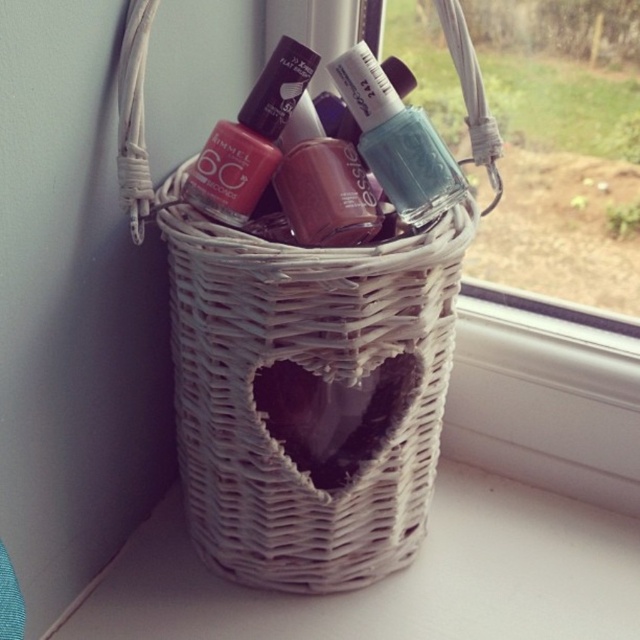
Is white wicker basket at lower left positioned before matte burgundy nail polish at center?

No, white wicker basket at lower left is further to the viewer.

Does white wicker basket at lower left appear under matte burgundy nail polish at center?

Correct, white wicker basket at lower left is located below matte burgundy nail polish at center.

Between point (632, 570) and point (371, 186), which one is positioned in front?

Point (371, 186) is more forward.

I want to click on white wicker basket at lower left, so click(392, 577).

Does point (380, 76) lie in front of point (237, 150)?

That is False.

Who is higher up, teal glossy nail polish at center or matte plastic nail polish at center?

matte plastic nail polish at center is higher up.

The height and width of the screenshot is (640, 640). I want to click on teal glossy nail polish at center, so click(x=396, y=140).

Where is `teal glossy nail polish at center`? The image size is (640, 640). teal glossy nail polish at center is located at coordinates (396, 140).

Is white wicker basket at center closer to camera compared to white wicker basket at lower left?

That is True.

Which of these two, white wicker basket at center or white wicker basket at lower left, stands shorter?

white wicker basket at lower left

This screenshot has width=640, height=640. In order to click on white wicker basket at center in this screenshot , I will do `click(298, 362)`.

Image resolution: width=640 pixels, height=640 pixels. I want to click on white wicker basket at center, so click(x=298, y=362).